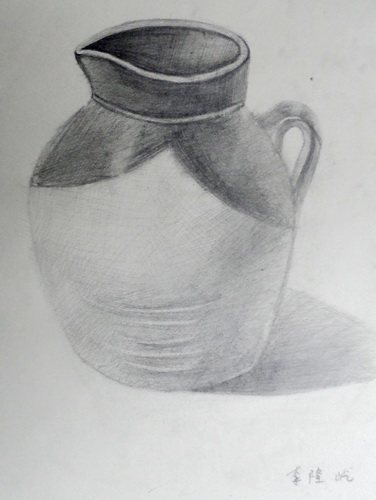
You are a GUI agent. You are given a task and a screenshot of the screen. Output one action in this format:
    pyautogui.click(x=<x>, y=<y>)
    Task: Click on the handle
    
    Given the screenshot: What is the action you would take?
    pyautogui.click(x=309, y=123)